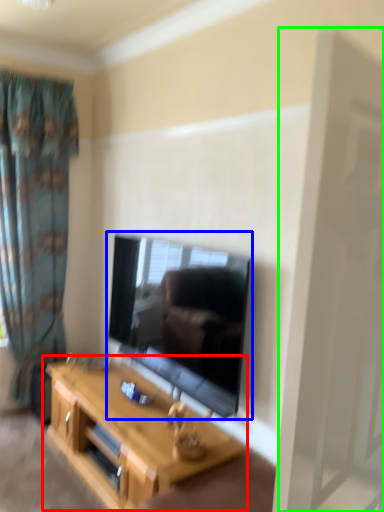
Question: Which object is the closest to the table (highlighted by a red box)? Choose among these: television (highlighted by a blue box) or screen door (highlighted by a green box).

Choices:
 (A) television
 (B) screen door

Answer: (A)